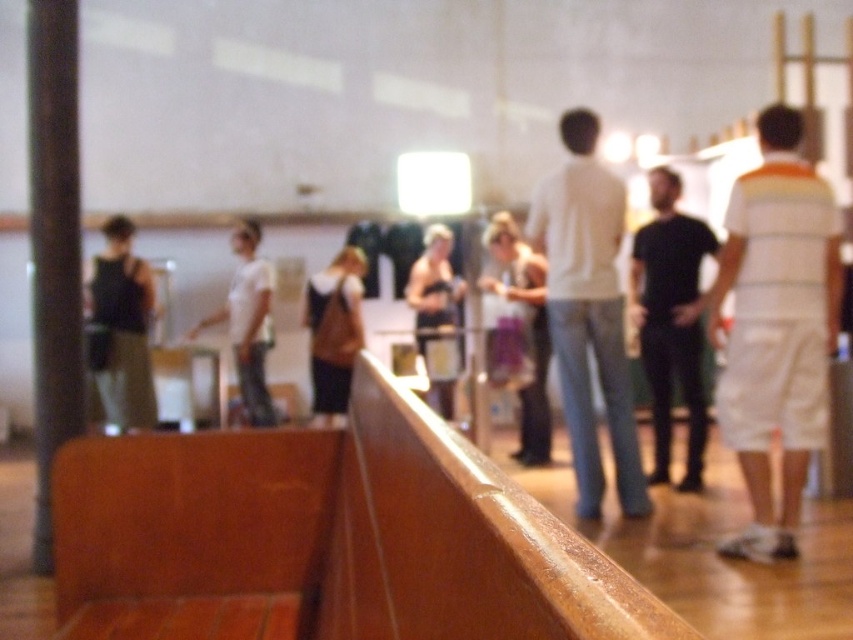
Does brown leather bag at center appear on the left side of shiny black tank top at center?

Indeed, brown leather bag at center is positioned on the left side of shiny black tank top at center.

This screenshot has width=853, height=640. I want to click on brown leather bag at center, so click(334, 330).

Is point (347, 317) less distant than point (445, 282)?

Yes, it is in front of point (445, 282).

I want to click on brown leather bag at center, so click(334, 330).

Is white striped shirt at right shorter than shiny black tank top at center?

No, white striped shirt at right is not shorter than shiny black tank top at center.

Measure the distance between point (798,193) and camera.

The distance of point (798,193) from camera is 3.08 meters.

The width and height of the screenshot is (853, 640). In order to click on white striped shirt at right in this screenshot , I will do `click(776, 326)`.

Is white matte shirt at center below matte black tank top at left?

Yes.

You are a GUI agent. You are given a task and a screenshot of the screen. Output one action in this format:
    pyautogui.click(x=<x>, y=<y>)
    Task: Click on the white matte shirt at center
    The image size is (853, 640).
    Given the screenshot: What is the action you would take?
    pyautogui.click(x=589, y=310)

This screenshot has height=640, width=853. I want to click on white matte shirt at center, so click(x=589, y=310).